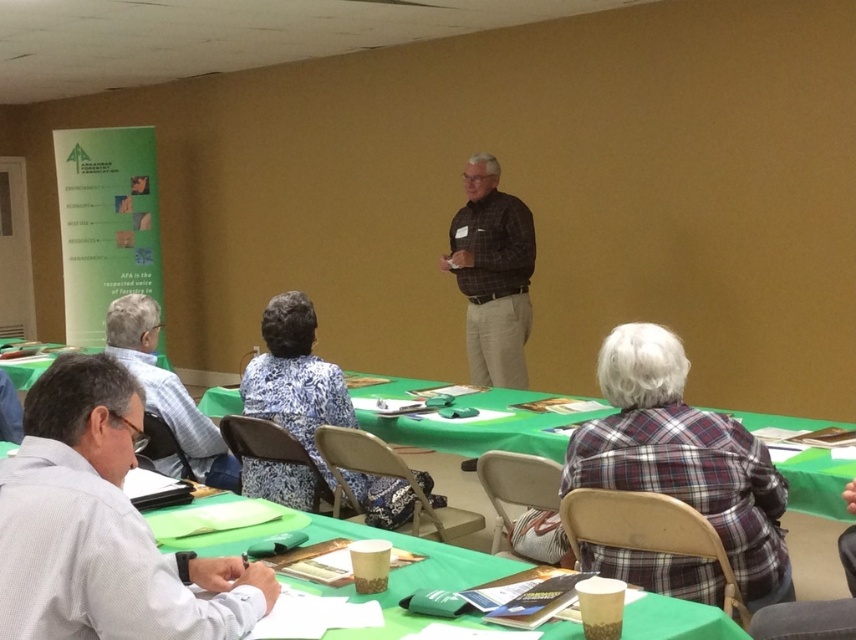
Question: Which point appears farthest from the camera in this image?

Choices:
 (A) (302, 444)
 (B) (129, 262)

Answer: (B)

Question: Is white shirt at left bigger than gray fabric shirt at lower left?

Choices:
 (A) no
 (B) yes

Answer: (A)

Question: Considering the real-world distances, which object is farthest from the white shirt at left?

Choices:
 (A) green fabric table at lower center
 (B) plaid fabric shirt at lower right
 (C) green paperboard at left
 (D) gray fabric shirt at lower left

Answer: (C)

Question: Is white shirt at left below black checkered shirt at center?

Choices:
 (A) no
 (B) yes

Answer: (B)

Question: Which object is closer to the camera taking this photo?

Choices:
 (A) plaid fabric shirt at lower right
 (B) green paperboard at left

Answer: (A)

Question: Does white shirt at left appear over green fabric table at lower center?

Choices:
 (A) no
 (B) yes

Answer: (A)